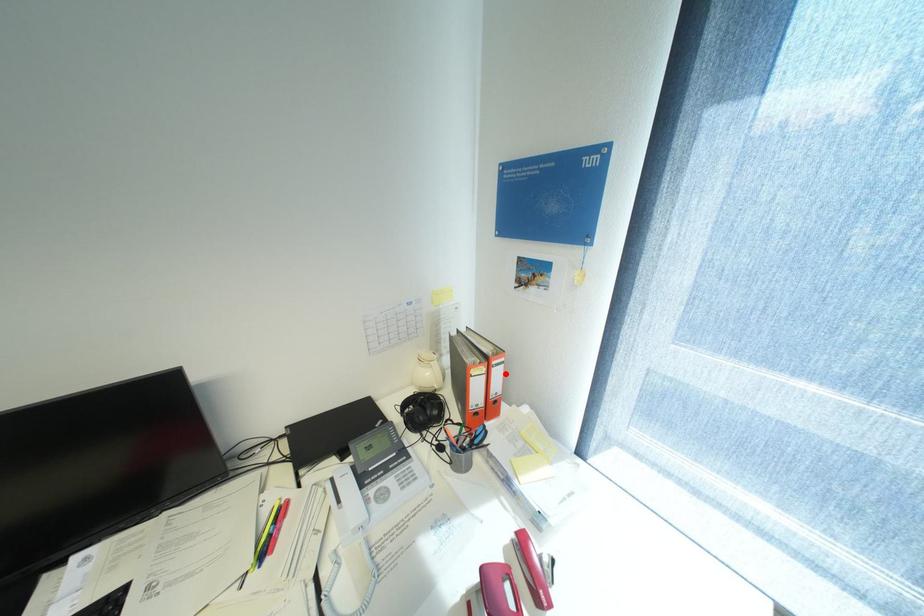
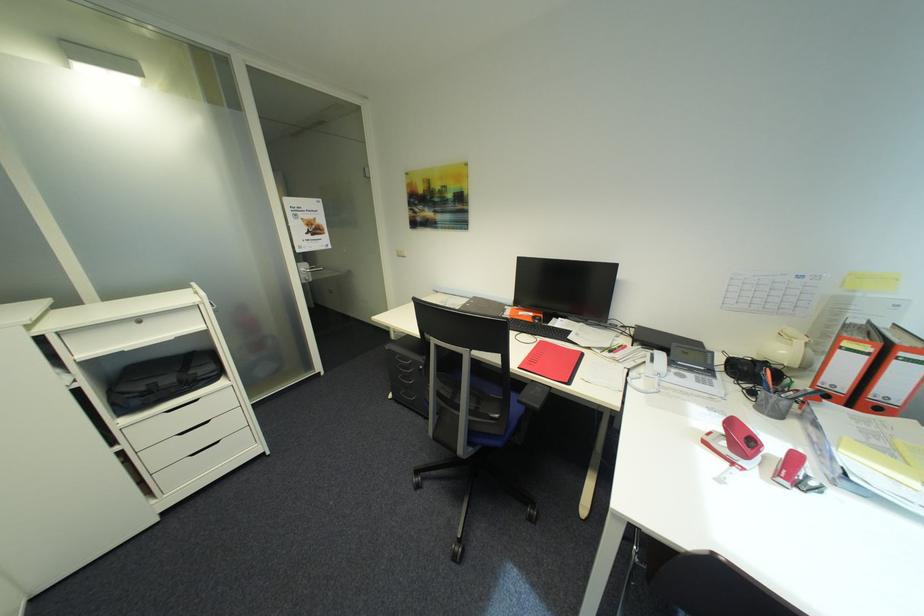
Where in the second image is the point corresponding to the highlighted location from the first image?

(912, 371)